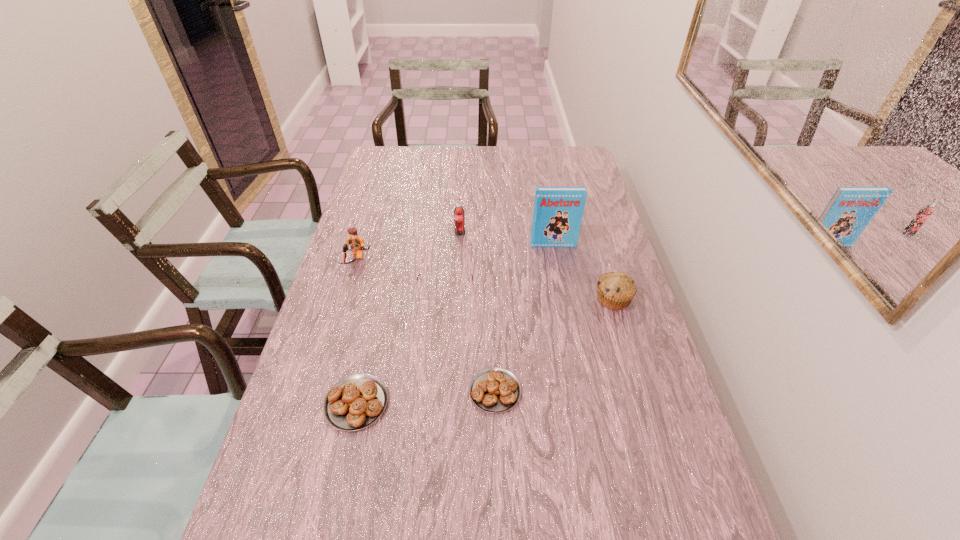
Where is `unoccupied position between the spectacles and the tallest object`? This screenshot has height=540, width=960. unoccupied position between the spectacles and the tallest object is located at coordinates (499, 271).

Find the location of `object that stands as the third closest to the Lego`. object that stands as the third closest to the Lego is located at coordinates (355, 402).

Identify which object is the nearest to the rightmost object. Please provide its 2D coordinates. Your answer should be formatted as a tuple, i.e. [(x, y)], where the tuple contains the x and y coordinates of a point satisfying the conditions above.

[(558, 211)]

Image resolution: width=960 pixels, height=540 pixels. Identify the location of free location that satisfies the following two spatial constraints: 1. on the back side of the fourth shortest object; 2. on the right side of the taller pastry. (379, 299).

Locate an element on the screen. This screenshot has height=540, width=960. vacant region that satisfies the following two spatial constraints: 1. on the front-facing side of the muffin; 2. on the right side of the third shortest object is located at coordinates (444, 299).

You are a GUI agent. You are given a task and a screenshot of the screen. Output one action in this format:
    pyautogui.click(x=<x>, y=<y>)
    Task: Click on the free location that satisfies the following two spatial constraints: 1. on the label of the shortest object; 2. on the right side of the sixth shortest object
    This screenshot has height=540, width=960.
    Given the screenshot: What is the action you would take?
    pyautogui.click(x=451, y=391)

You are a GUI agent. You are given a task and a screenshot of the screen. Output one action in this format:
    pyautogui.click(x=<x>, y=<y>)
    Task: Click on the vacant space that satisfies the following two spatial constraints: 1. on the front-facing side of the muffin; 2. on the right side of the spectacles
    This screenshot has width=960, height=540.
    Given the screenshot: What is the action you would take?
    pyautogui.click(x=444, y=299)

At what (x,y) coordinates should I click in order to perform the action: click on free location that satisfies the following two spatial constraints: 1. on the front-facing side of the spectacles; 2. on the right side of the shorter pastry. Please return your answer as a coordinate pair (x, y). Looking at the image, I should click on (437, 391).

At what (x,y) coordinates should I click in order to perform the action: click on free location that satisfies the following two spatial constraints: 1. on the label of the fourth shortest object; 2. on the right side of the soda bottle. Please return your answer as a coordinate pair (x, y). Looking at the image, I should click on (456, 299).